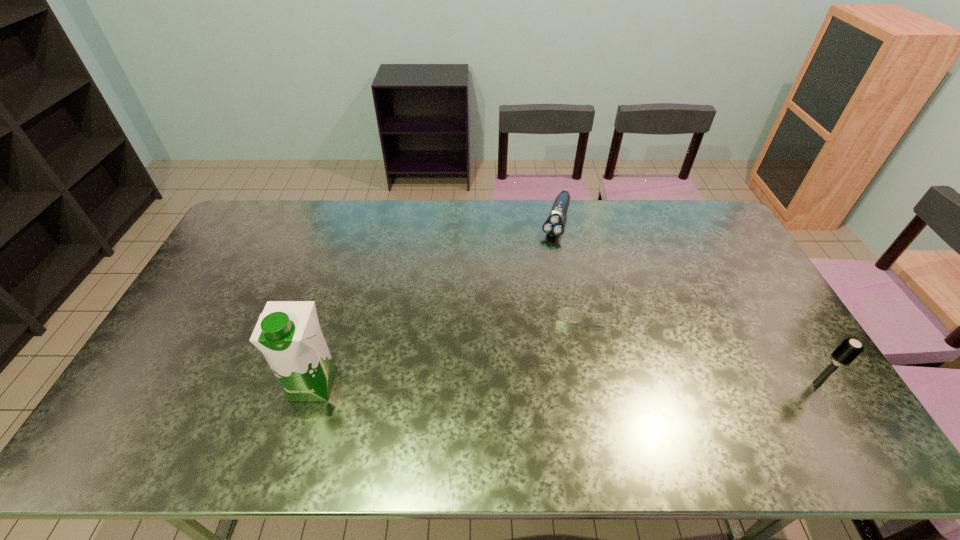
Image resolution: width=960 pixels, height=540 pixels. In order to click on soya milk in this screenshot , I will do `click(288, 333)`.

Where is `the leftmost object`? Image resolution: width=960 pixels, height=540 pixels. the leftmost object is located at coordinates (288, 333).

The height and width of the screenshot is (540, 960). Find the location of `the second tallest object`. the second tallest object is located at coordinates (849, 349).

You are a GUI agent. You are given a task and a screenshot of the screen. Output one action in this format:
    pyautogui.click(x=<x>, y=<y>)
    Task: Click on the rightmost object
    
    Given the screenshot: What is the action you would take?
    pyautogui.click(x=849, y=349)

Find the location of a particular element. Image resolution: width=960 pixels, height=540 pixels. the third nearest object is located at coordinates (566, 314).

In order to click on spectacles in this screenshot , I will do `click(566, 314)`.

This screenshot has height=540, width=960. I want to click on electric shaver, so click(x=553, y=226).

I want to click on the second shortest object, so click(x=553, y=226).

Locate an element on the screen. This screenshot has width=960, height=540. vacant space located 0.380m on the left of the rightmost object is located at coordinates (665, 383).

You are a GUI agent. You are given a task and a screenshot of the screen. Output one action in this format:
    pyautogui.click(x=<x>, y=<y>)
    Task: Click on the vacant space situated on the front-facing side of the spectacles
    This screenshot has height=540, width=960.
    Given the screenshot: What is the action you would take?
    pyautogui.click(x=587, y=385)